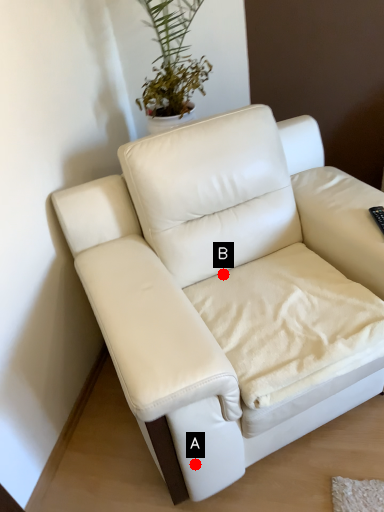
Question: Two points are circled on the image, labeled by A and B beside each circle. Which point is farther from the camera taking this photo?

Choices:
 (A) A is further
 (B) B is further

Answer: (B)